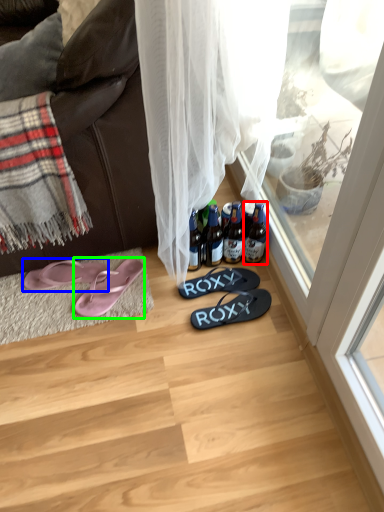
Question: Which is nearer to the bottle (highlighted by a red box)? footwear (highlighted by a blue box) or footwear (highlighted by a green box).

Choices:
 (A) footwear
 (B) footwear

Answer: (B)